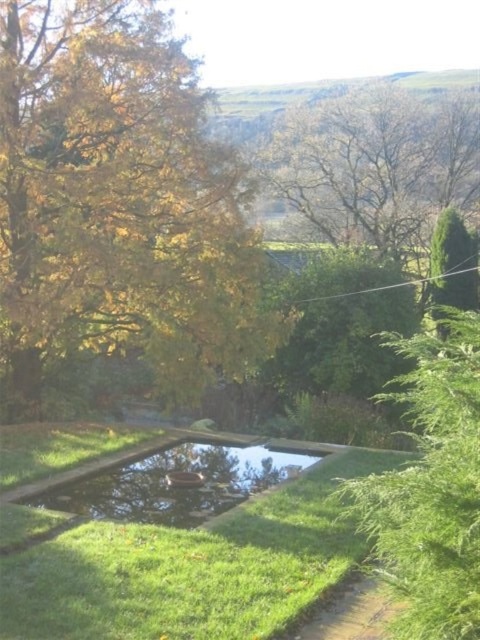
You are planning to place a small garden statue in the green grass at center. Considering the space available, will the statue fit comfortably without overcrowding the area compared to the green leafy tree at right?

The green grass at center is thinner than the green leafy tree at right, which means there is less space in the green grass at center. The statue may not fit comfortably there compared to the area around the green leafy tree at right.

You are standing in the middle of the green grass at center and want to walk towards the green leafy tree at right. Which direction should you face to walk directly towards it?

You should face towards the right direction because the green leafy tree at right is located to the right side of the green grass at center.